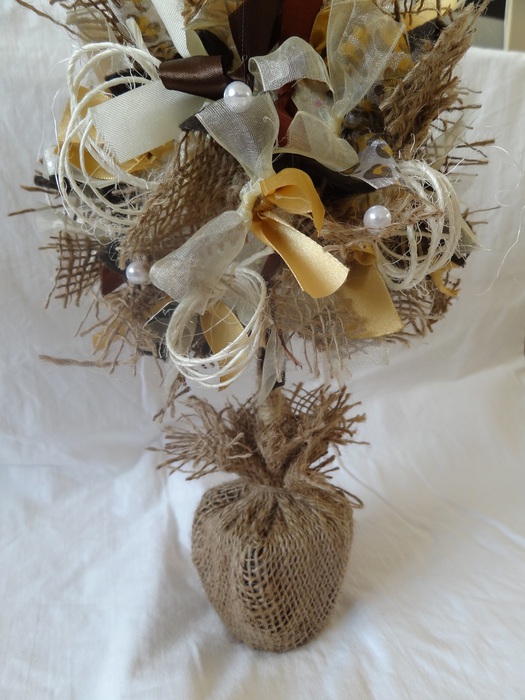
Image resolution: width=525 pixels, height=700 pixels. Identify the location of table. (456, 414).